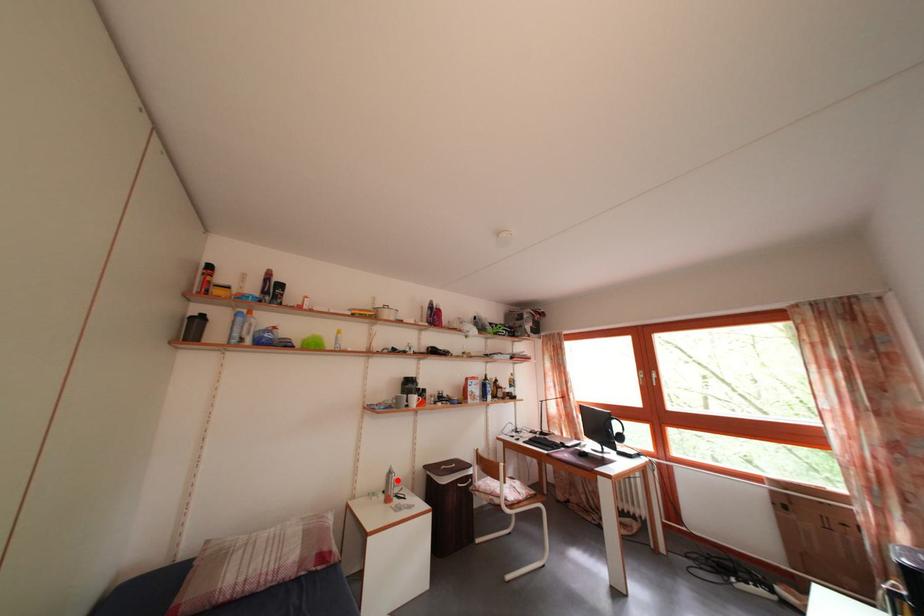
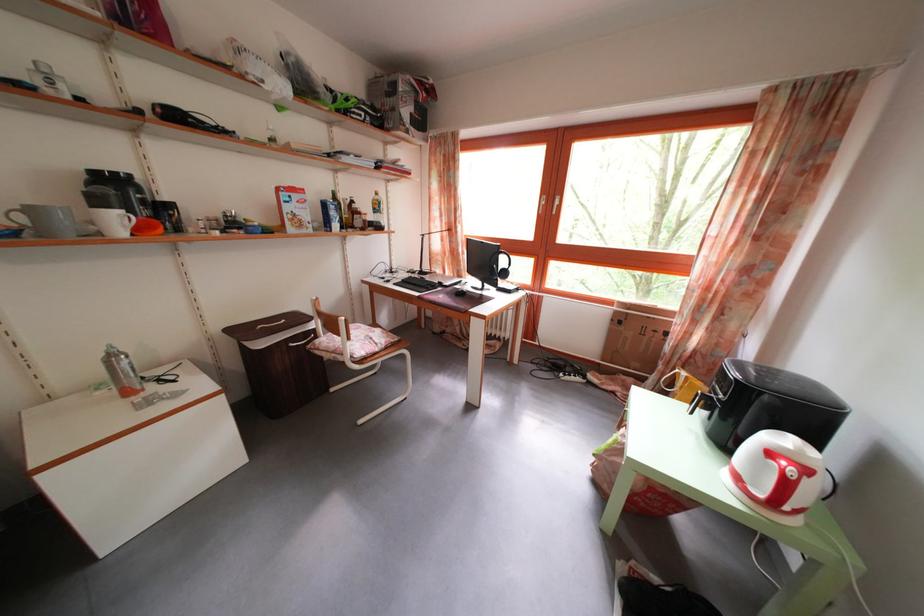
In the second image, find the point that corresponds to the highlighted location in the first image.

(118, 363)